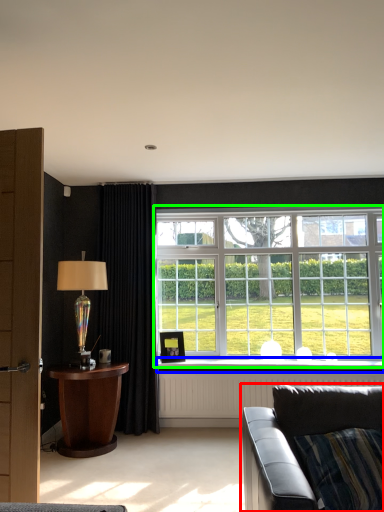
Question: Estimate the real-world distances between objects in this image. Which object is farther from studio couch (highlighted by a red box), window sill (highlighted by a blue box) or window (highlighted by a green box)?

Choices:
 (A) window sill
 (B) window

Answer: (B)